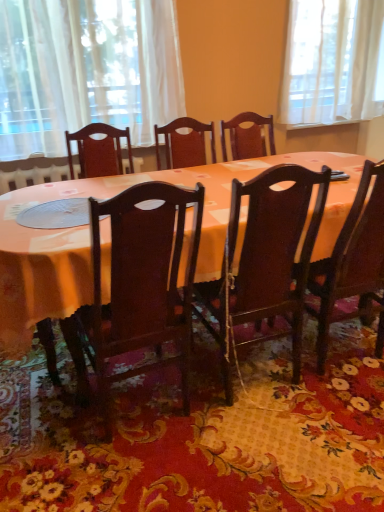
Question: Is matte wood table at center shorter than white sheer curtain at upper left?

Choices:
 (A) no
 (B) yes

Answer: (B)

Question: Could you tell me if matte wood table at center is facing white sheer curtain at upper left?

Choices:
 (A) yes
 (B) no

Answer: (B)

Question: Does matte wood table at center have a lesser width compared to white sheer curtain at upper left?

Choices:
 (A) no
 (B) yes

Answer: (A)

Question: Is the surface of matte wood table at center in direct contact with white sheer curtain at upper left?

Choices:
 (A) yes
 (B) no

Answer: (B)

Question: From the image's perspective, does matte wood table at center appear higher than white sheer curtain at upper left?

Choices:
 (A) yes
 (B) no

Answer: (B)

Question: From the image's perspective, is dark wood chair at center, placed as the 1th chair when sorted from left to right, positioned above or below dark wood chair at center, marked as the second chair in a left-to-right arrangement?

Choices:
 (A) above
 (B) below

Answer: (B)

Question: Choose the correct answer: Is dark wood chair at center, the 3th chair when ordered from right to left, inside dark wood chair at center, marked as the second chair in a left-to-right arrangement, or outside it?

Choices:
 (A) inside
 (B) outside

Answer: (B)

Question: Is dark wood chair at center, placed as the 1th chair when sorted from left to right, wider or thinner than dark wood chair at center, acting as the second chair starting from the right?

Choices:
 (A) thin
 (B) wide

Answer: (A)

Question: Based on their positions, is dark wood chair at center, placed as the 1th chair when sorted from left to right, located to the left or right of dark wood chair at center, marked as the second chair in a left-to-right arrangement?

Choices:
 (A) right
 (B) left

Answer: (B)

Question: From a real-world perspective, is dark wood chair at center, marked as the second chair in a left-to-right arrangement, above or below matte wood table at center?

Choices:
 (A) below
 (B) above

Answer: (B)

Question: Considering the positions of dark wood chair at center, marked as the second chair in a left-to-right arrangement, and matte wood table at center in the image, is dark wood chair at center, marked as the second chair in a left-to-right arrangement, wider or thinner than matte wood table at center?

Choices:
 (A) wide
 (B) thin

Answer: (B)

Question: Does point (279, 289) appear closer or farther from the camera than point (322, 243)?

Choices:
 (A) farther
 (B) closer

Answer: (B)

Question: From the image's perspective, is dark wood chair at center, acting as the second chair starting from the right, located above or below matte wood table at center?

Choices:
 (A) below
 (B) above

Answer: (A)

Question: In the image, is white sheer curtain at upper left positioned in front of or behind dark wood chair at center, acting as the second chair starting from the right?

Choices:
 (A) front
 (B) behind

Answer: (B)

Question: From the image's perspective, is white sheer curtain at upper left above or below dark wood chair at center, acting as the second chair starting from the right?

Choices:
 (A) above
 (B) below

Answer: (A)